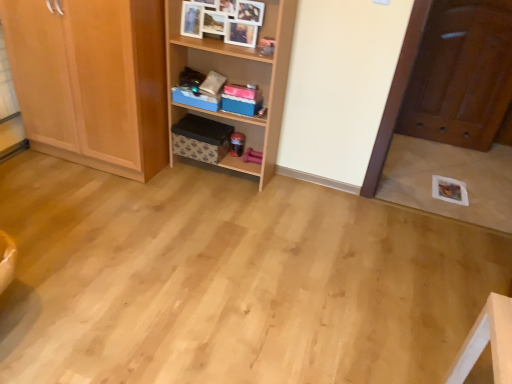
Question: Does shiny brown door at right have a lesser width compared to wooden cabinet at upper center?

Choices:
 (A) yes
 (B) no

Answer: (B)

Question: Does shiny brown door at right lie in front of wooden cabinet at upper center?

Choices:
 (A) yes
 (B) no

Answer: (B)

Question: From a real-world perspective, is shiny brown door at right physically below wooden cabinet at upper center?

Choices:
 (A) yes
 (B) no

Answer: (A)

Question: Can wooden cabinet at upper center be found inside shiny brown door at right?

Choices:
 (A) no
 (B) yes

Answer: (A)

Question: From the image's perspective, is shiny brown door at right on top of wooden cabinet at upper center?

Choices:
 (A) no
 (B) yes

Answer: (A)

Question: Is shiny brown door at right to the right of wooden cabinet at upper center from the viewer's perspective?

Choices:
 (A) no
 (B) yes

Answer: (B)

Question: Is wooden cabinet at upper center not inside wooden shelf at center?

Choices:
 (A) yes
 (B) no

Answer: (B)

Question: Is wooden cabinet at upper center positioned behind wooden shelf at center?

Choices:
 (A) yes
 (B) no

Answer: (A)

Question: Can you confirm if wooden cabinet at upper center is wider than wooden shelf at center?

Choices:
 (A) yes
 (B) no

Answer: (B)

Question: Is wooden cabinet at upper center next to wooden shelf at center and touching it?

Choices:
 (A) no
 (B) yes

Answer: (A)

Question: Can you confirm if wooden cabinet at upper center is taller than wooden shelf at center?

Choices:
 (A) yes
 (B) no

Answer: (B)

Question: From the image's perspective, would you say wooden cabinet at upper center is shown under wooden shelf at center?

Choices:
 (A) no
 (B) yes

Answer: (A)

Question: Does wooden shelf at center have a lesser width compared to light wood cabinet at left?

Choices:
 (A) yes
 (B) no

Answer: (A)